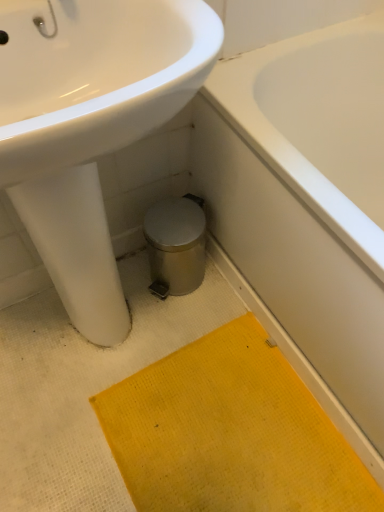
In order to click on free space underneath yellow textured bath mat at lower center (from a real-world perspective) in this screenshot , I will do `click(225, 435)`.